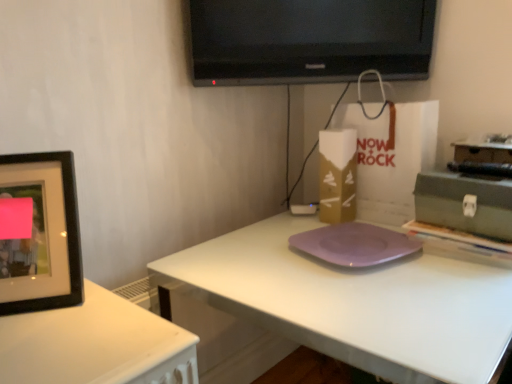
Identify the location of blank space situated above green matte toolbox at right (from a real-world perspective). (472, 178).